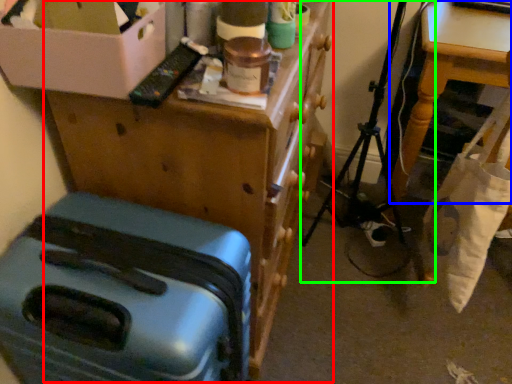
Question: Which object is the farthest from furniture (highlighted by a red box)? Choose among these: table (highlighted by a blue box) or folding chair (highlighted by a green box).

Choices:
 (A) table
 (B) folding chair

Answer: (B)